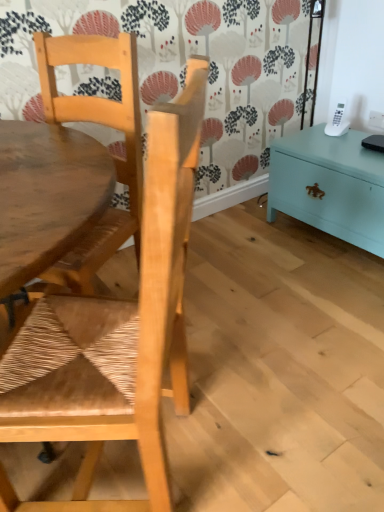
Question: From a real-world perspective, is teal painted wood chest at right below natural wood chair at upper left, the first chair when ordered from top to bottom?

Choices:
 (A) yes
 (B) no

Answer: (A)

Question: Is teal painted wood chest at right positioned behind natural wood chair at upper left, the first chair when ordered from top to bottom?

Choices:
 (A) yes
 (B) no

Answer: (A)

Question: Can you confirm if teal painted wood chest at right is thinner than natural wood chair at upper left, the first chair when ordered from top to bottom?

Choices:
 (A) no
 (B) yes

Answer: (B)

Question: From a real-world perspective, is teal painted wood chest at right physically above natural wood chair at upper left, the first chair when ordered from top to bottom?

Choices:
 (A) no
 (B) yes

Answer: (A)

Question: Can you confirm if teal painted wood chest at right is wider than natural wood chair at upper left, the second chair positioned from the bottom?

Choices:
 (A) no
 (B) yes

Answer: (A)

Question: Considering the relative positions of teal painted wood chest at right and natural wood chair at upper left, the second chair positioned from the bottom, in the image provided, is teal painted wood chest at right in front of natural wood chair at upper left, the second chair positioned from the bottom,?

Choices:
 (A) no
 (B) yes

Answer: (A)

Question: Considering the relative sizes of white plastic power outlet at upper right and natural wood chair at upper left, the second chair positioned from the bottom, in the image provided, is white plastic power outlet at upper right shorter than natural wood chair at upper left, the second chair positioned from the bottom,?

Choices:
 (A) yes
 (B) no

Answer: (A)

Question: Can you confirm if white plastic power outlet at upper right is positioned to the left of natural wood chair at upper left, the first chair when ordered from top to bottom?

Choices:
 (A) no
 (B) yes

Answer: (A)

Question: From a real-world perspective, is white plastic power outlet at upper right below natural wood chair at upper left, the first chair when ordered from top to bottom?

Choices:
 (A) no
 (B) yes

Answer: (B)

Question: Is white plastic power outlet at upper right positioned before natural wood chair at upper left, the first chair when ordered from top to bottom?

Choices:
 (A) no
 (B) yes

Answer: (A)

Question: Does white plastic power outlet at upper right have a larger size compared to natural wood chair at upper left, the second chair positioned from the bottom?

Choices:
 (A) yes
 (B) no

Answer: (B)

Question: Would you say white plastic power outlet at upper right is outside natural wood chair at upper left, the second chair positioned from the bottom?

Choices:
 (A) yes
 (B) no

Answer: (A)

Question: Can you confirm if natural wood chair at upper left, the first chair when ordered from top to bottom, is thinner than white plastic power outlet at upper right?

Choices:
 (A) no
 (B) yes

Answer: (A)